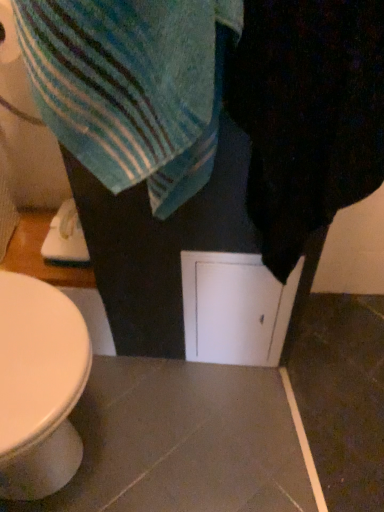
Question: Is blue striped towel at upper left closer to camera compared to black fuzzy towel at right?

Choices:
 (A) no
 (B) yes

Answer: (A)

Question: From the image's perspective, is blue striped towel at upper left beneath black fuzzy towel at right?

Choices:
 (A) no
 (B) yes

Answer: (A)

Question: Considering the relative sizes of blue striped towel at upper left and black fuzzy towel at right in the image provided, is blue striped towel at upper left smaller than black fuzzy towel at right?

Choices:
 (A) yes
 (B) no

Answer: (A)

Question: Can you confirm if blue striped towel at upper left is wider than black fuzzy towel at right?

Choices:
 (A) yes
 (B) no

Answer: (B)

Question: From a real-world perspective, is blue striped towel at upper left beneath black fuzzy towel at right?

Choices:
 (A) no
 (B) yes

Answer: (A)

Question: Is blue striped towel at upper left inside or outside of black fuzzy towel at right?

Choices:
 (A) outside
 (B) inside

Answer: (A)

Question: Is blue striped towel at upper left to the left or to the right of black fuzzy towel at right in the image?

Choices:
 (A) right
 (B) left

Answer: (B)

Question: From the image's perspective, is blue striped towel at upper left above or below black fuzzy towel at right?

Choices:
 (A) above
 (B) below

Answer: (A)

Question: Based on their sizes in the image, would you say blue striped towel at upper left is bigger or smaller than black fuzzy towel at right?

Choices:
 (A) big
 (B) small

Answer: (B)

Question: Do you think black fuzzy towel at right is within white matte screen door at center, or outside of it?

Choices:
 (A) outside
 (B) inside

Answer: (A)

Question: In terms of width, does black fuzzy towel at right look wider or thinner when compared to white matte screen door at center?

Choices:
 (A) thin
 (B) wide

Answer: (B)

Question: Based on their sizes in the image, would you say black fuzzy towel at right is bigger or smaller than white matte screen door at center?

Choices:
 (A) big
 (B) small

Answer: (A)

Question: From the image's perspective, is black fuzzy towel at right located above or below white matte screen door at center?

Choices:
 (A) above
 (B) below

Answer: (A)

Question: From their relative heights in the image, would you say blue striped towel at upper left is taller or shorter than white matte screen door at center?

Choices:
 (A) short
 (B) tall

Answer: (A)

Question: Is blue striped towel at upper left inside the boundaries of white matte screen door at center, or outside?

Choices:
 (A) outside
 (B) inside

Answer: (A)